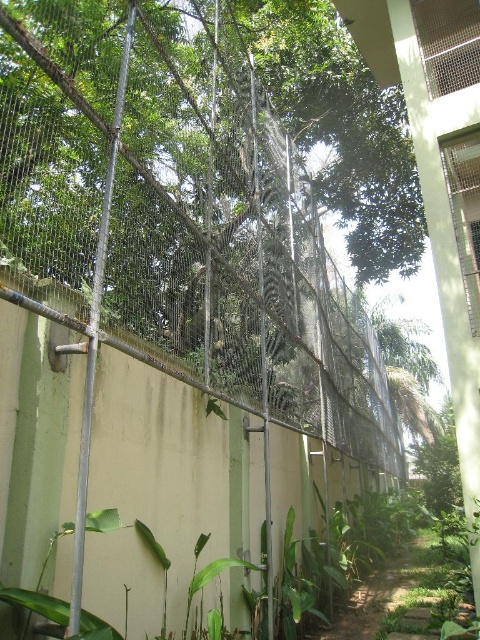
Question: In this image, where is dirt path at lower center located relative to green leafy tree at right?

Choices:
 (A) right
 (B) left

Answer: (B)

Question: Does dirt path at lower center have a smaller size compared to green leafy tree at right?

Choices:
 (A) yes
 (B) no

Answer: (A)

Question: Which object is farther from the camera taking this photo?

Choices:
 (A) dirt path at lower center
 (B) green leafy tree at right

Answer: (B)

Question: Can you confirm if dirt path at lower center is positioned to the right of green leafy tree at right?

Choices:
 (A) yes
 (B) no

Answer: (B)

Question: Which point is closer to the camera taking this photo?

Choices:
 (A) (403, 584)
 (B) (451, 476)

Answer: (A)